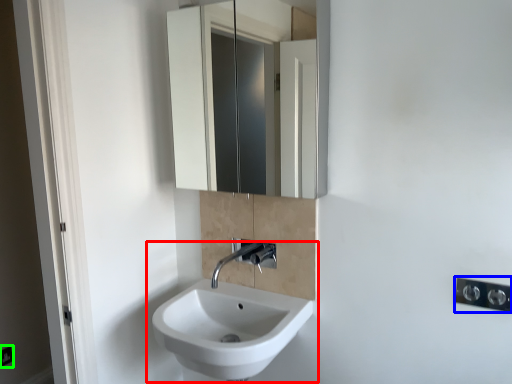
Question: Which object is positioned closest to sink (highlighted by a red box)? Select from light switch (highlighted by a blue box) and electric outlet (highlighted by a green box).

Choices:
 (A) light switch
 (B) electric outlet

Answer: (A)